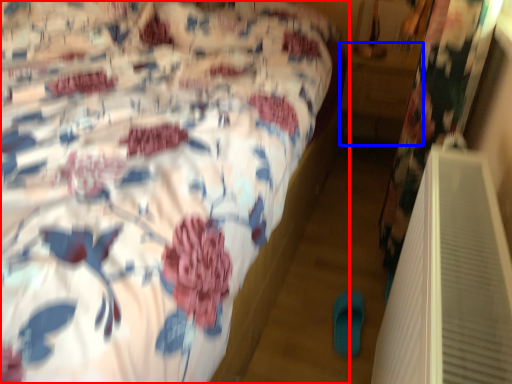
Question: Which object appears closest to the camera in this image, bed (highlighted by a red box) or table (highlighted by a blue box)?

Choices:
 (A) bed
 (B) table

Answer: (A)